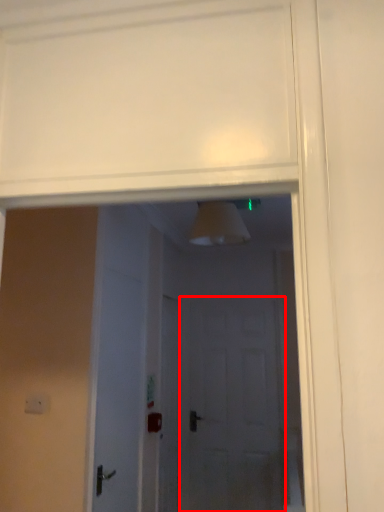
Question: Observing the image, what is the correct spatial positioning of screen door (annotated by the red box) in reference to door?

Choices:
 (A) left
 (B) right

Answer: (B)